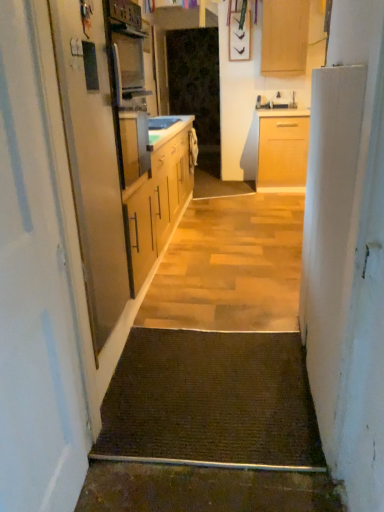
Question: From a real-world perspective, relative to white glossy sink at center, is light wood cabinet at upper center vertically above or below?

Choices:
 (A) above
 (B) below

Answer: (A)

Question: Considering the positions of light wood cabinet at upper center and white glossy sink at center in the image, is light wood cabinet at upper center bigger or smaller than white glossy sink at center?

Choices:
 (A) small
 (B) big

Answer: (B)

Question: Which object is positioned farthest from the brown textured mat at center?

Choices:
 (A) transparent plastic screen door at center, arranged as the second screen door when ordered from the bottom
 (B) light wood cabinet at upper center
 (C) metallic silver screen door at left, which appears as the 1th screen door when viewed from the left
 (D) white matte door at left
 (E) white glossy sink at center

Answer: (B)

Question: Considering the real-world distances, which object is farthest from the metallic silver screen door at left, the first screen door positioned from the bottom?

Choices:
 (A) brown textured mat at center
 (B) light wood cabinet at upper center
 (C) transparent plastic screen door at center, the 1th screen door viewed from the right
 (D) white glossy sink at center
 (E) white matte door at left

Answer: (B)